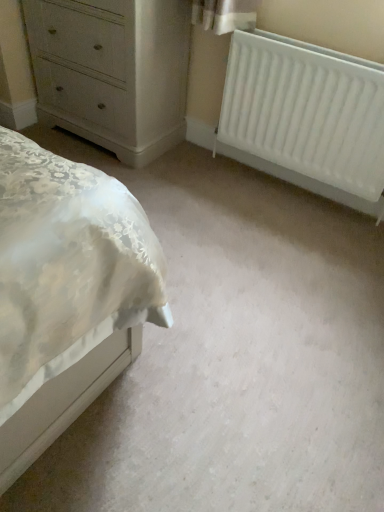
This screenshot has height=512, width=384. Find the location of `vacant space to the left of white matte radiator at right`. vacant space to the left of white matte radiator at right is located at coordinates (210, 189).